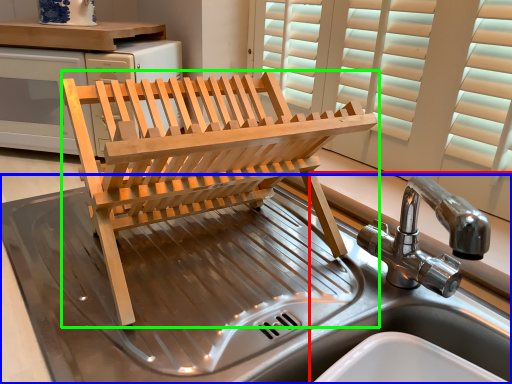
Question: Which object is positioned closest to sink (highlighted by a red box)? Select from sink (highlighted by a blue box) and furniture (highlighted by a green box).

Choices:
 (A) sink
 (B) furniture

Answer: (B)